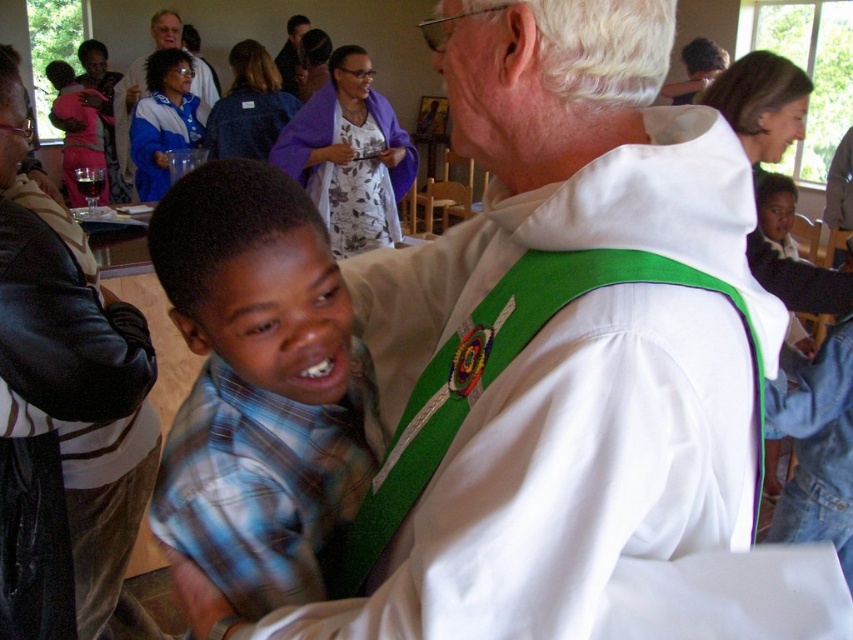
You are organizing a photo shoot and need to place a small accessory between the blue plaid shirt at center and the smooth brown leather jacket at upper center. Based on their widths, which object should the accessory be placed closer to?

The blue plaid shirt at center has a lesser width compared to the smooth brown leather jacket at upper center, so the accessory should be placed closer to the blue plaid shirt at center to maintain balance.

You are standing at the origin point of the room. You want to approach the blue plaid shirt at center. What direction should you move in to reach it?

Since the blue plaid shirt at center is located at coordinates point (258, 385), you should move towards the right and slightly forward to reach it.

What is the color of the object located at the coordinate point (567,476)?

The point (567,476) is on the white matte vest at center, so the color is white.